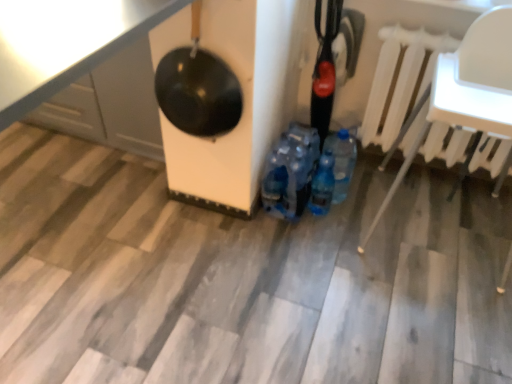
Question: From the image's perspective, would you say white plastic radiator at upper right is positioned over shiny black pan at upper left?

Choices:
 (A) yes
 (B) no

Answer: (B)

Question: From a real-world perspective, is white plastic radiator at upper right located higher than shiny black pan at upper left?

Choices:
 (A) yes
 (B) no

Answer: (A)

Question: Is white plastic radiator at upper right at the left side of shiny black pan at upper left?

Choices:
 (A) yes
 (B) no

Answer: (B)

Question: Can you confirm if white plastic radiator at upper right is positioned to the right of shiny black pan at upper left?

Choices:
 (A) yes
 (B) no

Answer: (A)

Question: Can you confirm if white plastic radiator at upper right is thinner than shiny black pan at upper left?

Choices:
 (A) no
 (B) yes

Answer: (B)

Question: Is white plastic radiator at upper right aimed at shiny black pan at upper left?

Choices:
 (A) yes
 (B) no

Answer: (B)

Question: Does black glossy wok at upper left come behind blue translucent bottle at center?

Choices:
 (A) no
 (B) yes

Answer: (A)

Question: From a real-world perspective, does black glossy wok at upper left stand above blue translucent bottle at center?

Choices:
 (A) no
 (B) yes

Answer: (B)

Question: Does black glossy wok at upper left appear on the right side of blue translucent bottle at center?

Choices:
 (A) yes
 (B) no

Answer: (B)

Question: From the image's perspective, is black glossy wok at upper left below blue translucent bottle at center?

Choices:
 (A) no
 (B) yes

Answer: (A)

Question: Is black glossy wok at upper left positioned beyond the bounds of blue translucent bottle at center?

Choices:
 (A) yes
 (B) no

Answer: (A)

Question: Is blue translucent bottle at center surrounded by black glossy wok at upper left?

Choices:
 (A) yes
 (B) no

Answer: (B)

Question: From the image's perspective, is blue translucent bottle at center located above shiny black pan at upper left?

Choices:
 (A) no
 (B) yes

Answer: (A)